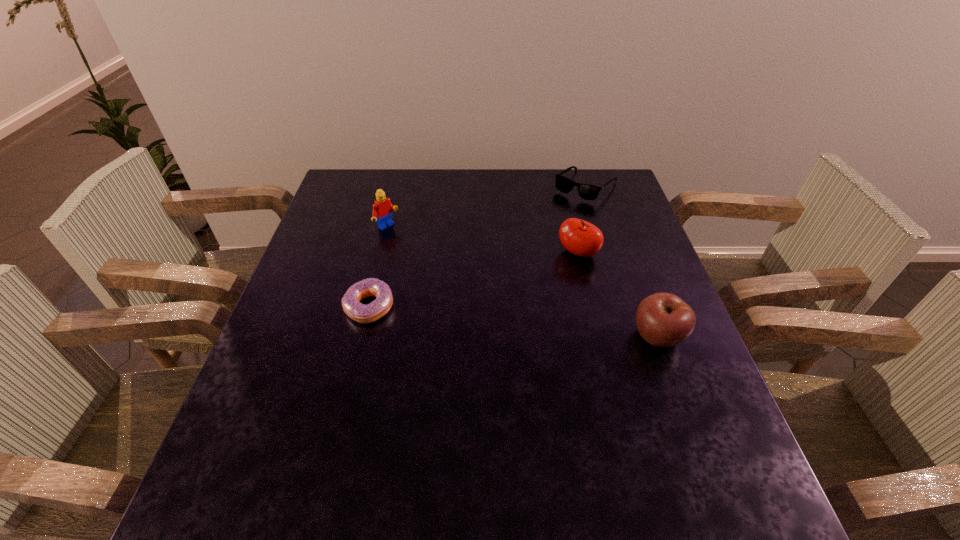
Identify the location of Lego that is at the left edge. The image size is (960, 540). (382, 208).

The image size is (960, 540). Find the location of `sunglasses situated at the right edge`. sunglasses situated at the right edge is located at coordinates (586, 191).

In order to click on object present at the far right corner in this screenshot , I will do `click(586, 191)`.

Identify the location of vacant region at the far edge. The width and height of the screenshot is (960, 540). (546, 192).

The image size is (960, 540). I want to click on vacant space at the near edge of the desktop, so click(x=352, y=431).

Where is `vacant space at the left edge`? This screenshot has width=960, height=540. vacant space at the left edge is located at coordinates (335, 231).

You are a GUI agent. You are given a task and a screenshot of the screen. Output one action in this format:
    pyautogui.click(x=<x>, y=<y>)
    Task: Click on the blank space at the right edge of the desktop
    The width and height of the screenshot is (960, 540).
    Given the screenshot: What is the action you would take?
    pyautogui.click(x=644, y=259)

Where is `vacant area at the near left corner of the desktop`? vacant area at the near left corner of the desktop is located at coordinates (244, 457).

You are a GUI agent. You are given a task and a screenshot of the screen. Output one action in this format:
    pyautogui.click(x=<x>, y=<y>)
    Task: Click on the vacant area at the far right corner
    This screenshot has height=540, width=960.
    Given the screenshot: What is the action you would take?
    pyautogui.click(x=605, y=195)

Locate an element on the screen. Image resolution: width=960 pixels, height=540 pixels. blank space at the near right corner is located at coordinates (699, 437).